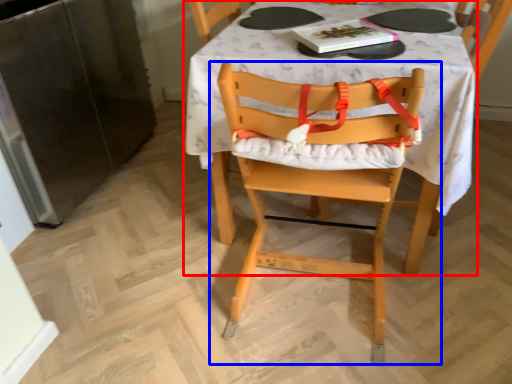
Question: Among these objects, which one is nearest to the camera, table (highlighted by a red box) or chair (highlighted by a blue box)?

Choices:
 (A) table
 (B) chair

Answer: (B)